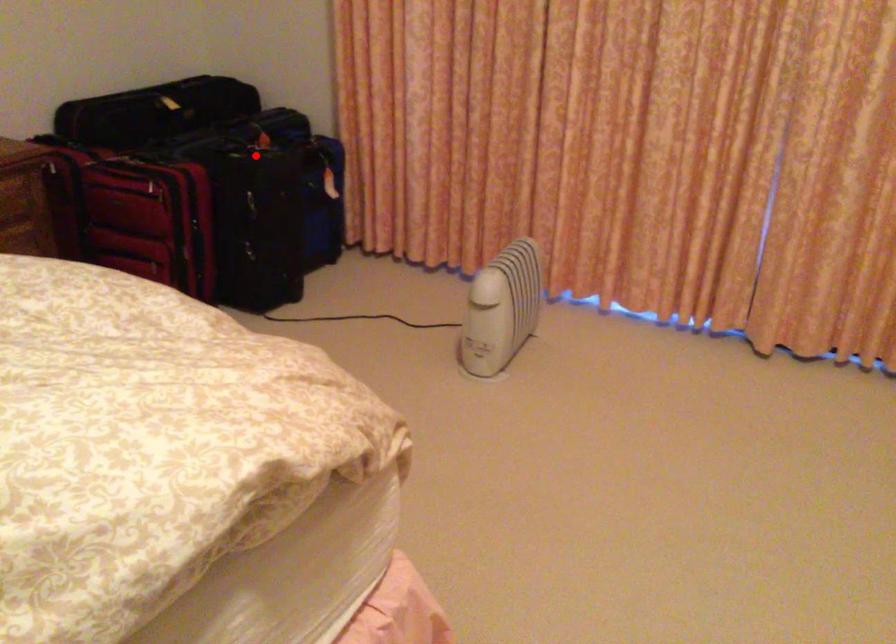
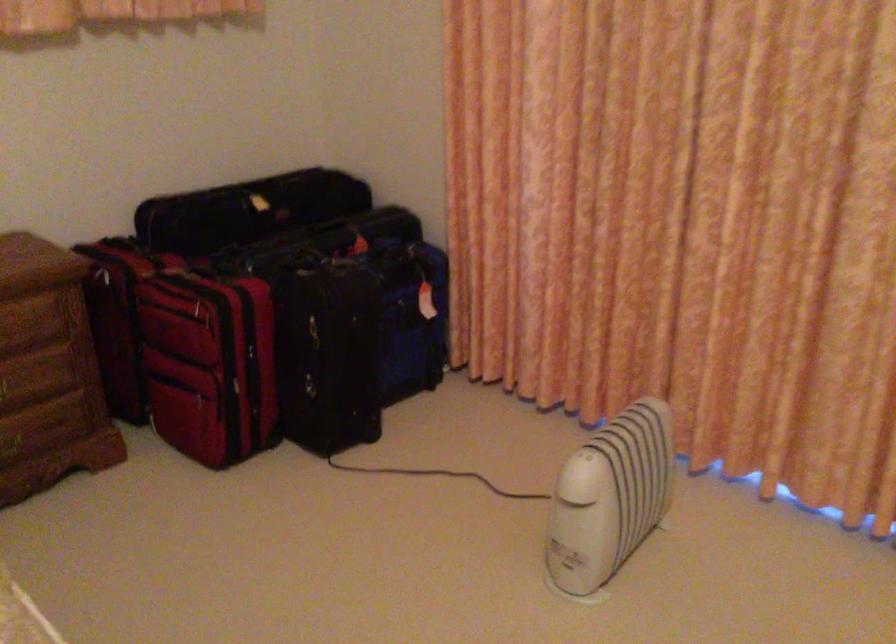
Question: I am providing you with two images of the same scene from different viewpoints. A red point is marked on the first image. Can you still see the location of the red point in image 2?

Choices:
 (A) Yes
 (B) No

Answer: (A)